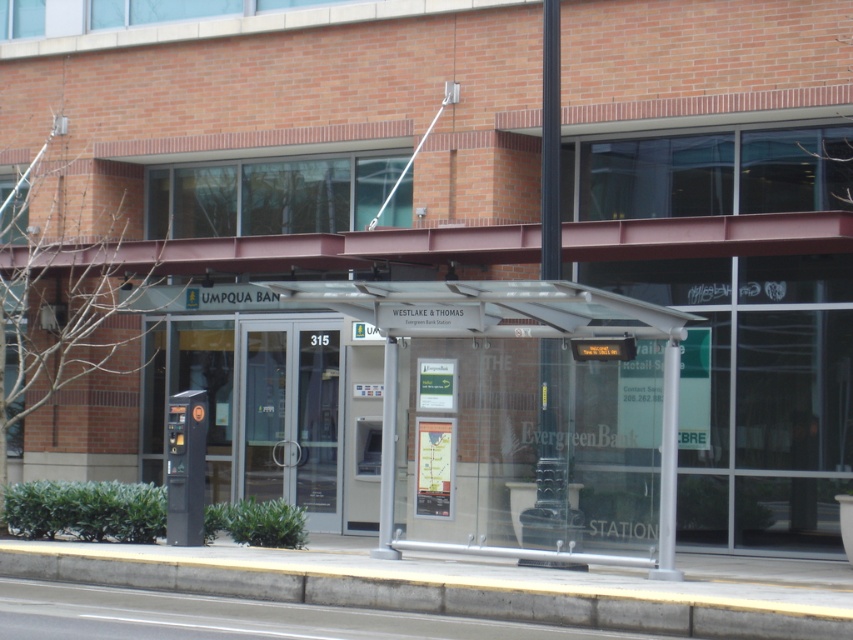
Question: Which object is the closest to the transparent glass bus stop at center?

Choices:
 (A) clear glass doors at center
 (B) black plastic phone box at left

Answer: (B)

Question: Does transparent glass bus stop at center appear on the right side of clear glass doors at center?

Choices:
 (A) yes
 (B) no

Answer: (A)

Question: Does gray concrete curb at lower center appear on the right side of transparent glass bus stop at center?

Choices:
 (A) no
 (B) yes

Answer: (B)

Question: Is clear glass doors at center wider than black plastic phone box at left?

Choices:
 (A) no
 (B) yes

Answer: (B)

Question: Which object is the closest to the clear glass doors at center?

Choices:
 (A) black plastic phone box at left
 (B) gray concrete curb at lower center
 (C) transparent glass bus stop at center

Answer: (A)

Question: Which object is the farthest from the transparent glass bus stop at center?

Choices:
 (A) gray concrete curb at lower center
 (B) clear glass doors at center

Answer: (B)